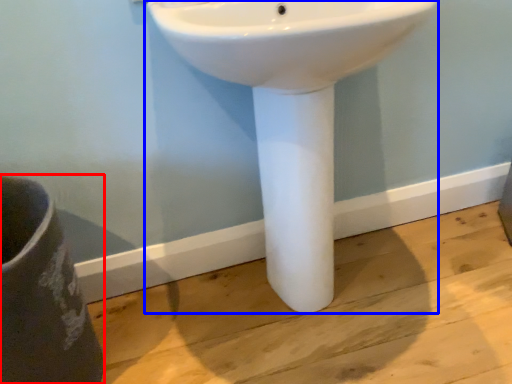
Question: Which point is further to the camera, porcelain (highlighted by a red box) or sink (highlighted by a blue box)?

Choices:
 (A) porcelain
 (B) sink

Answer: (A)